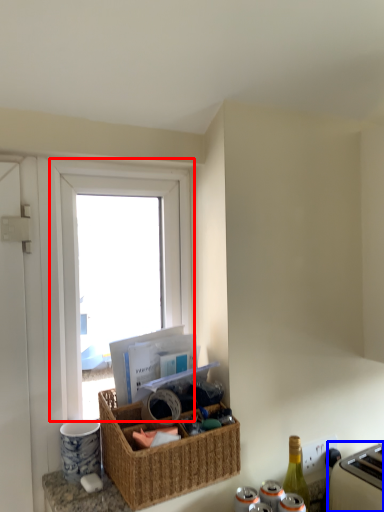
Question: Which point is closer to the camera, window (highlighted by a red box) or appliance (highlighted by a blue box)?

Choices:
 (A) window
 (B) appliance

Answer: (B)